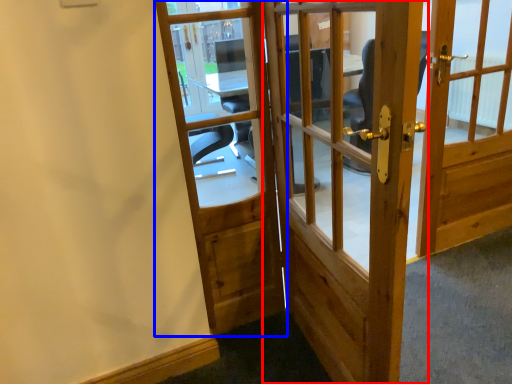
Question: Which object appears farthest to the camera in this image, door (highlighted by a red box) or door (highlighted by a blue box)?

Choices:
 (A) door
 (B) door

Answer: (B)